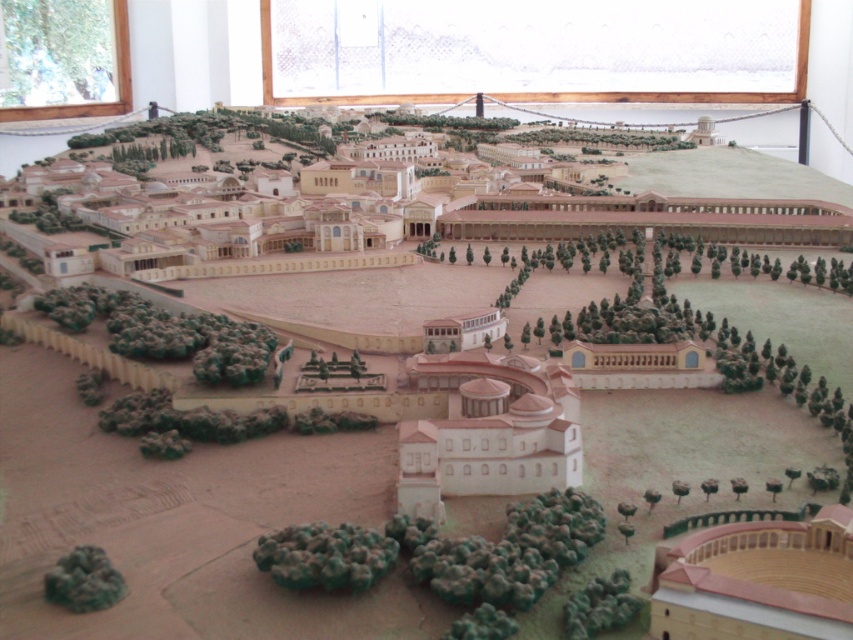
You are an archaeologist examining the miniature model of the historical settlement. You notice the light brown clay amphitheater at lower right and the green matte tree at lower left. Based on their positions, which object is closer to the ground level?

The light brown clay amphitheater at lower right is below the green matte tree at lower left, so it is closer to the ground level.